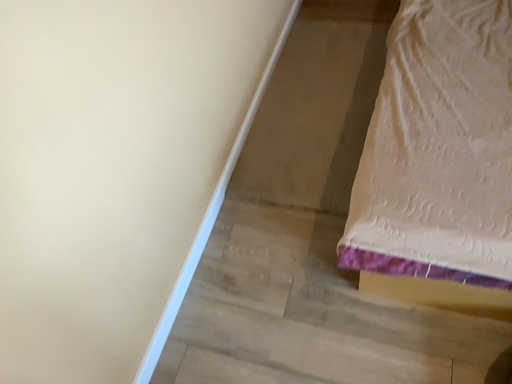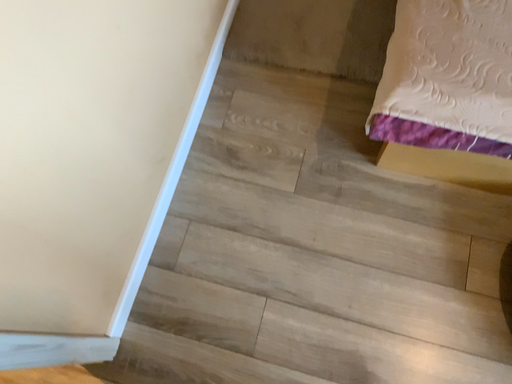
Question: How did the camera likely rotate when shooting the video?

Choices:
 (A) rotated upward
 (B) rotated downward

Answer: (B)